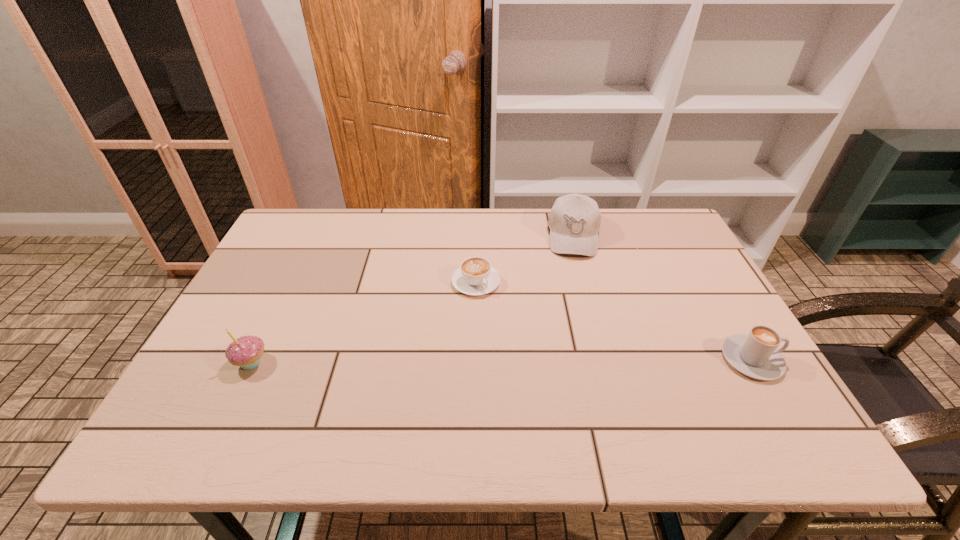
Locate an element on the screen. The width and height of the screenshot is (960, 540). vacant position located on the side of the left cappuccino with the handle is located at coordinates (536, 360).

You are a GUI agent. You are given a task and a screenshot of the screen. Output one action in this format:
    pyautogui.click(x=<x>, y=<y>)
    Task: Click on the free space located on the front-facing side of the farthest object
    
    Given the screenshot: What is the action you would take?
    pyautogui.click(x=577, y=367)

What are the coordinates of `vacant point located on the front-facing side of the farthest object` in the screenshot? It's located at click(x=577, y=338).

The image size is (960, 540). Identify the location of free space located 0.160m on the front-facing side of the farthest object. (576, 296).

The width and height of the screenshot is (960, 540). What are the coordinates of `object located in the far edge section of the desktop` in the screenshot? It's located at (574, 221).

What are the coordinates of `cupcake at the near edge` in the screenshot? It's located at (246, 351).

At what (x,y) coordinates should I click in order to perform the action: click on cappuccino located at the near edge. Please return your answer as a coordinate pair (x, y). The width and height of the screenshot is (960, 540). Looking at the image, I should click on (755, 355).

Locate an element on the screen. object present at the left edge is located at coordinates (246, 351).

Image resolution: width=960 pixels, height=540 pixels. What are the coordinates of `object at the right edge` in the screenshot? It's located at (755, 355).

At what (x,y) coordinates should I click in order to perform the action: click on object situated at the near left corner. Please return your answer as a coordinate pair (x, y). The image size is (960, 540). Looking at the image, I should click on (246, 351).